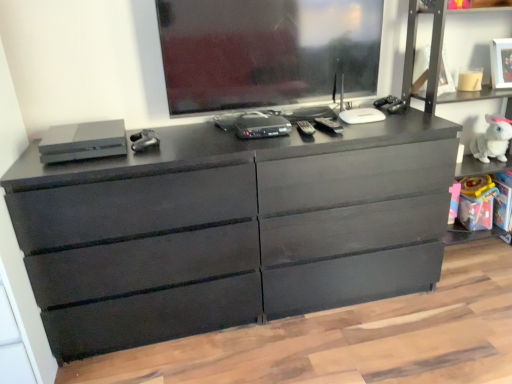
You are a GUI agent. You are given a task and a screenshot of the screen. Output one action in this format:
    pyautogui.click(x=<x>, y=<y>)
    Task: Click on the vacant space behind matte black controller at center, marked as the 2th equipment in a left-to-right arrangement
    This screenshot has width=512, height=384.
    Given the screenshot: What is the action you would take?
    tap(167, 131)